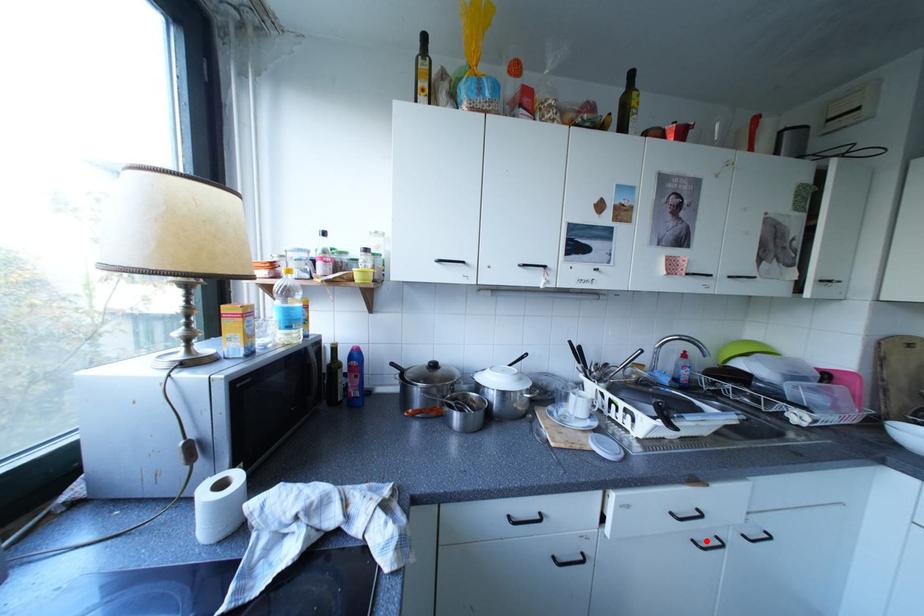
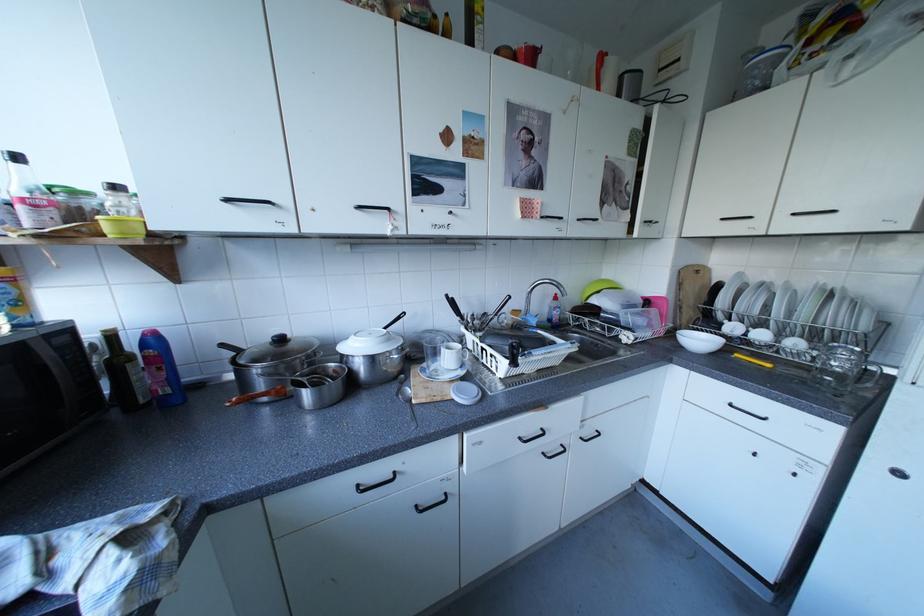
Question: A red point is marked in image1. In image2, is the corresponding 3D point closer to the camera or farther? Reply with the corresponding letter.

Choices:
 (A) The corresponding 3D point is closer.
 (B) The corresponding 3D point is farther.

Answer: (B)